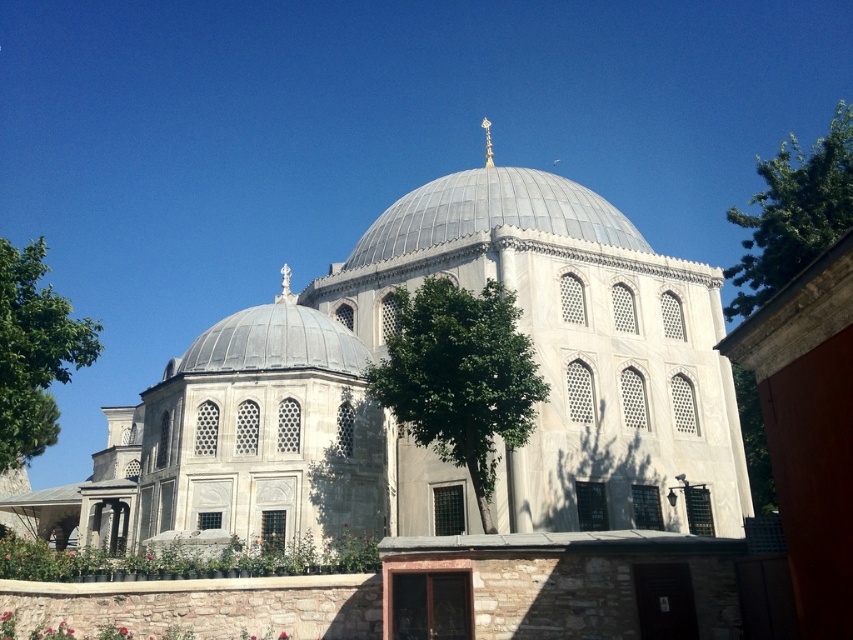
Which is more to the left, gray metallic dome at center or green leafy tree at left?

Positioned to the left is green leafy tree at left.

Between gray metallic dome at center and green leafy tree at left, which one is positioned lower?

green leafy tree at left

What do you see at coordinates (492, 211) in the screenshot? The width and height of the screenshot is (853, 640). I see `gray metallic dome at center` at bounding box center [492, 211].

You are a GUI agent. You are given a task and a screenshot of the screen. Output one action in this format:
    pyautogui.click(x=<x>, y=<y>)
    Task: Click on the gray metallic dome at center
    The image size is (853, 640).
    Given the screenshot: What is the action you would take?
    pyautogui.click(x=492, y=211)

Can you confirm if white stone dome at center is bigger than green leafy tree at center?

Yes.

Can you confirm if white stone dome at center is smaller than green leafy tree at center?

Actually, white stone dome at center might be larger than green leafy tree at center.

Is point (686, 492) closer to camera compared to point (503, 307)?

No.

You are a GUI agent. You are given a task and a screenshot of the screen. Output one action in this format:
    pyautogui.click(x=<x>, y=<y>)
    Task: Click on the white stone dome at center
    
    Given the screenshot: What is the action you would take?
    pyautogui.click(x=392, y=416)

Does gray metallic dome at center have a smaller size compared to gray stone dome at center?

No, gray metallic dome at center is not smaller than gray stone dome at center.

Is gray metallic dome at center taller than gray stone dome at center?

Correct, gray metallic dome at center is much taller as gray stone dome at center.

Is point (544, 186) positioned after point (250, 346)?

That is True.

The height and width of the screenshot is (640, 853). I want to click on gray metallic dome at center, so click(492, 211).